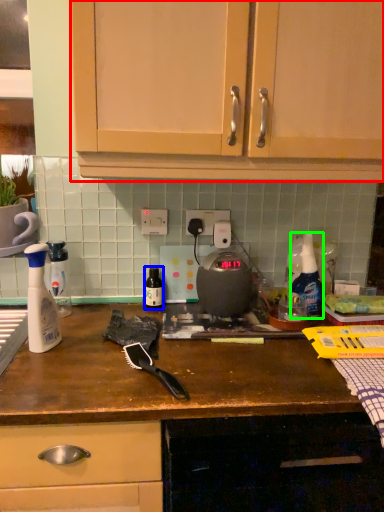
Question: Estimate the real-world distances between objects in this image. Which object is closer to cabinetry (highlighted by a red box), bottle (highlighted by a blue box) or cleaning product (highlighted by a green box)?

Choices:
 (A) bottle
 (B) cleaning product

Answer: (B)